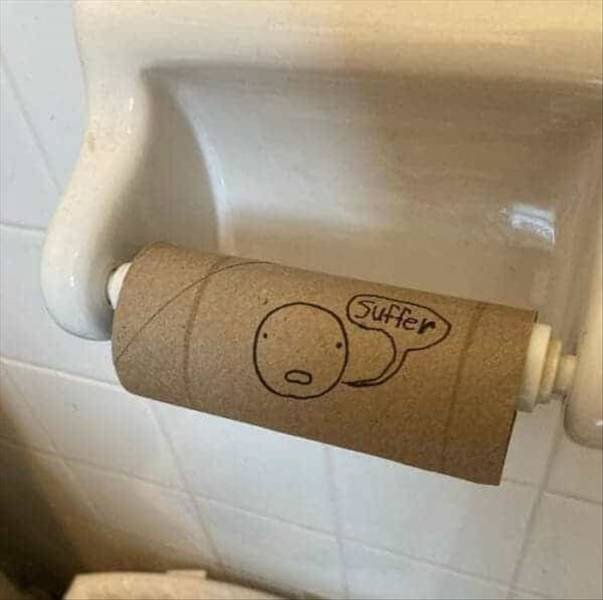
In order to click on bracket in this screenshot , I will do `click(131, 133)`.